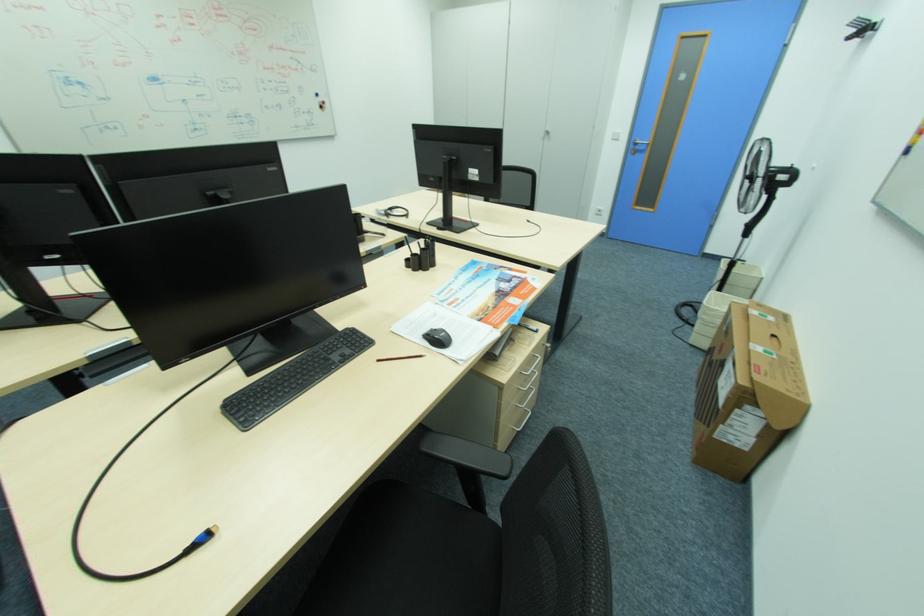
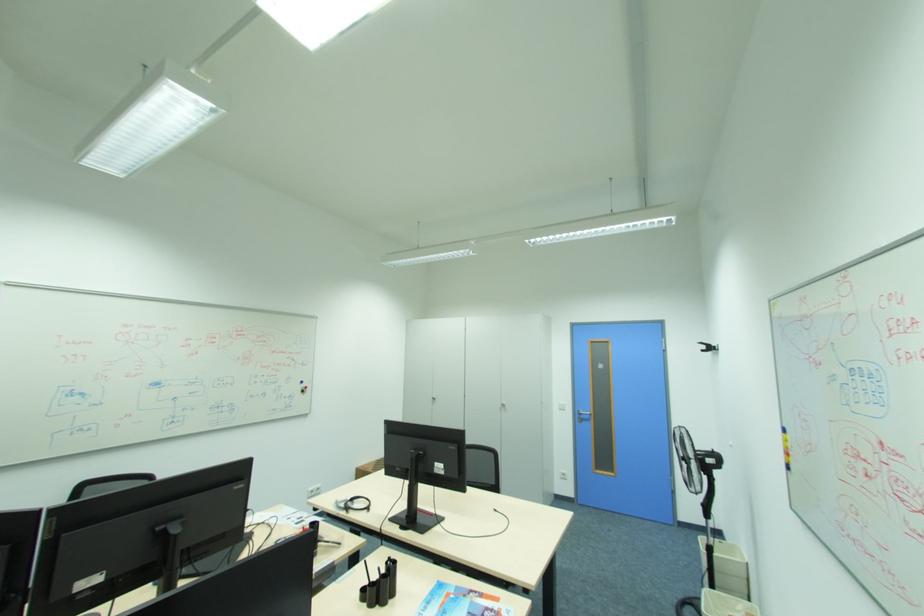
Where in the second image is the point corresponding to point (553, 134) from the first image?

(508, 406)